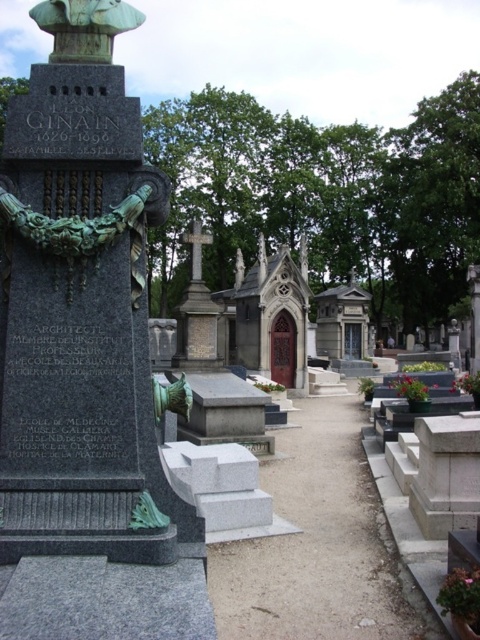
Question: Is bronze/bronzed stone monument at center thinner than green patina statue at upper left?

Choices:
 (A) yes
 (B) no

Answer: (B)

Question: Which object is closer to the camera taking this photo?

Choices:
 (A) green patina statue at upper left
 (B) bronze/bronzed stone monument at center

Answer: (B)

Question: Can you confirm if bronze/bronzed stone monument at center is positioned above green patina statue at upper left?

Choices:
 (A) yes
 (B) no

Answer: (B)

Question: Which point is farther from the camera taking this photo?

Choices:
 (A) (101, 64)
 (B) (45, 10)

Answer: (B)

Question: Can you confirm if bronze/bronzed stone monument at center is thinner than green patina statue at upper left?

Choices:
 (A) no
 (B) yes

Answer: (A)